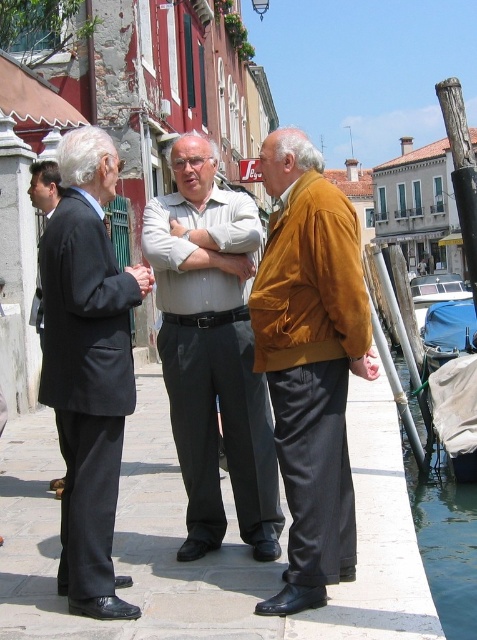
Find the location of `matte black suit at left`. matte black suit at left is located at coordinates (87, 365).

Does matte black suit at left have a greater height compared to clear blue water at lower right?

Yes, matte black suit at left is taller than clear blue water at lower right.

Is point (93, 316) more distant than point (402, 358)?

No, (93, 316) is in front of (402, 358).

At what (x,y) coordinates should I click in order to perform the action: click on matte black suit at left. Please return your answer as a coordinate pair (x, y). This screenshot has height=640, width=477. Looking at the image, I should click on (87, 365).

Does matte orange jacket at center have a lesser width compared to light gray cotton shirt at center?

Yes, matte orange jacket at center is thinner than light gray cotton shirt at center.

The height and width of the screenshot is (640, 477). Describe the element at coordinates (311, 362) in the screenshot. I see `matte orange jacket at center` at that location.

Where is `matte orange jacket at center`? This screenshot has width=477, height=640. matte orange jacket at center is located at coordinates (311, 362).

Does matte orange jacket at center have a greater width compared to black suit coat at left?

No, matte orange jacket at center is not wider than black suit coat at left.

Is matte orange jacket at center to the right of black suit coat at left from the viewer's perspective?

Correct, you'll find matte orange jacket at center to the right of black suit coat at left.

From the picture: Who is more forward, (341,209) or (41,211)?

Point (341,209)

The width and height of the screenshot is (477, 640). Identify the location of matte orange jacket at center. (311, 362).